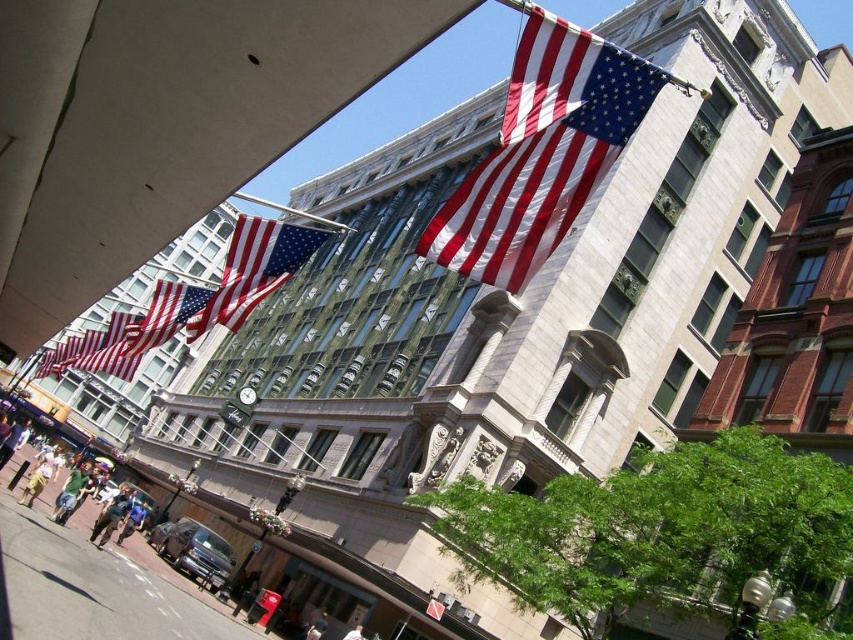
Between point (233, 289) and point (157, 346), which one is positioned in front?

Positioned in front is point (233, 289).

The image size is (853, 640). What do you see at coordinates (254, 269) in the screenshot? I see `red-white-blue fabric flag at center` at bounding box center [254, 269].

The width and height of the screenshot is (853, 640). In order to click on red-white-blue fabric flag at center in this screenshot , I will do `click(254, 269)`.

In the scene shown: Can you confirm if red-white-striped fabric flag at upper center is positioned below red-white-striped fabric flag at center?

No, red-white-striped fabric flag at upper center is not below red-white-striped fabric flag at center.

Who is lower down, red-white-striped fabric flag at upper center or red-white-striped fabric flag at center?

red-white-striped fabric flag at center is below.

The height and width of the screenshot is (640, 853). I want to click on red-white-striped fabric flag at upper center, so click(543, 152).

Find the location of a particular element. red-white-striped fabric flag at upper center is located at coordinates (543, 152).

Is red-white-blue fabric flag at center bigger than red-white-blue fabric flag at center-left?

Incorrect, red-white-blue fabric flag at center is not larger than red-white-blue fabric flag at center-left.

Does red-white-blue fabric flag at center have a lesser width compared to red-white-blue fabric flag at center-left?

Correct, red-white-blue fabric flag at center's width is less than red-white-blue fabric flag at center-left's.

Which is in front, point (271, 289) or point (73, 362)?

Point (271, 289) is more forward.

You are a GUI agent. You are given a task and a screenshot of the screen. Output one action in this format:
    pyautogui.click(x=<x>, y=<y>)
    Task: Click on the red-white-blue fabric flag at center
    
    Given the screenshot: What is the action you would take?
    pyautogui.click(x=254, y=269)